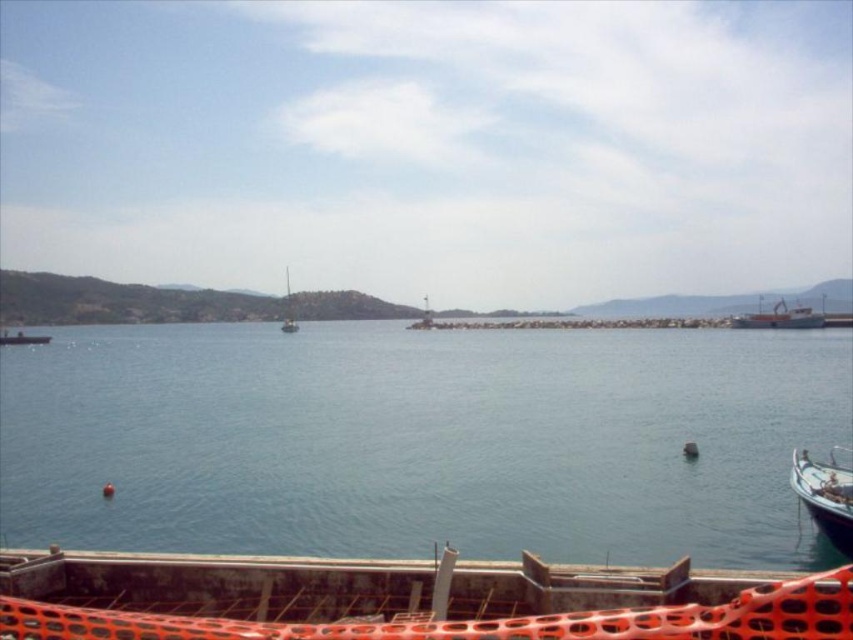
Question: In this image, where is blue water at center located relative to white wooden boat at lower right?

Choices:
 (A) left
 (B) right

Answer: (A)

Question: Which object is positioned farthest from the white wooden boat at lower right?

Choices:
 (A) blue water at center
 (B) white sailboat at center
 (C) orange painted metal boat at right

Answer: (B)

Question: Is orange painted metal boat at right further to the viewer compared to white sailboat at center?

Choices:
 (A) yes
 (B) no

Answer: (B)

Question: Which object is farther from the camera taking this photo?

Choices:
 (A) white sailboat at center
 (B) orange painted metal boat at right

Answer: (A)

Question: Which point is closer to the camera?

Choices:
 (A) white sailboat at center
 (B) orange painted metal boat at right

Answer: (B)

Question: Does white wooden boat at lower right have a greater width compared to white sailboat at center?

Choices:
 (A) no
 (B) yes

Answer: (A)